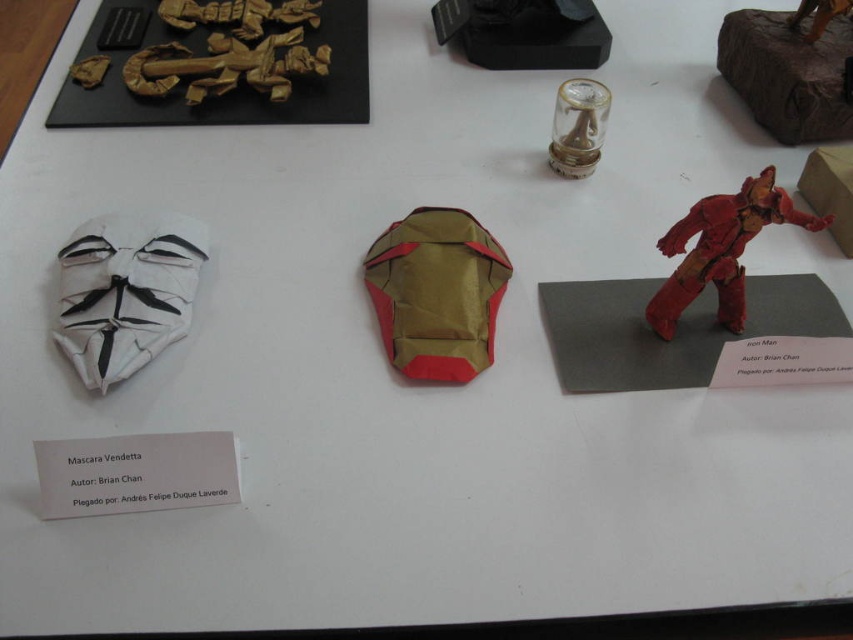
Question: Is black matte figurine at upper center below clear glass figurine at center?

Choices:
 (A) no
 (B) yes

Answer: (A)

Question: Which of the following is the closest to the observer?

Choices:
 (A) (584, 118)
 (B) (753, 216)

Answer: (B)

Question: Which of these objects is positioned farthest from the red papier-mâché iron man at right?

Choices:
 (A) white paper mask at left
 (B) black matte figurine at upper center
 (C) gold paper mask at center

Answer: (A)

Question: Is wooden figurine at upper right further to the viewer compared to red papier-mâché iron man at right?

Choices:
 (A) yes
 (B) no

Answer: (A)

Question: Is white paper mask at left below clear glass figurine at center?

Choices:
 (A) yes
 (B) no

Answer: (A)

Question: Which object is closer to the camera taking this photo?

Choices:
 (A) red papier-mâché iron man at right
 (B) black matte figurine at upper center

Answer: (A)